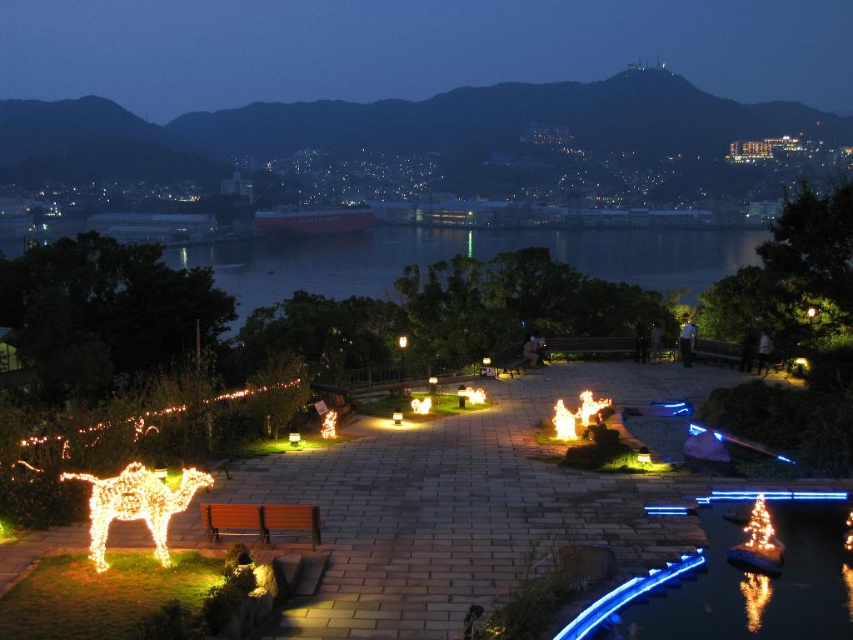
Can you confirm if blue illuminated water at lower right is positioned to the right of illuminated wireframe camel at lower left?

Yes, blue illuminated water at lower right is to the right of illuminated wireframe camel at lower left.

Is point (709, 609) positioned before point (170, 504)?

That is True.

Identify the location of blue illuminated water at lower right. The width and height of the screenshot is (853, 640). (740, 579).

Is illuminated wireframe camel at lower left positioned behind brown wooden bench at lower left?

No, it is not.

Is illuminated wireframe camel at lower left shorter than brown wooden bench at lower left?

No, illuminated wireframe camel at lower left is not shorter than brown wooden bench at lower left.

Which is behind, point (184, 502) or point (294, 525)?

Positioned behind is point (294, 525).

Find the location of a particular element. The width and height of the screenshot is (853, 640). illuminated wireframe camel at lower left is located at coordinates (136, 504).

Can you confirm if blue illuminated water at lower right is smaller than brown wooden bench at lower left?

Correct, blue illuminated water at lower right occupies less space than brown wooden bench at lower left.

Is blue illuminated water at lower right in front of brown wooden bench at lower left?

That is True.

Which is behind, point (737, 570) or point (213, 529)?

Point (213, 529)

Find the location of a particular element. The height and width of the screenshot is (640, 853). blue illuminated water at lower right is located at coordinates (740, 579).